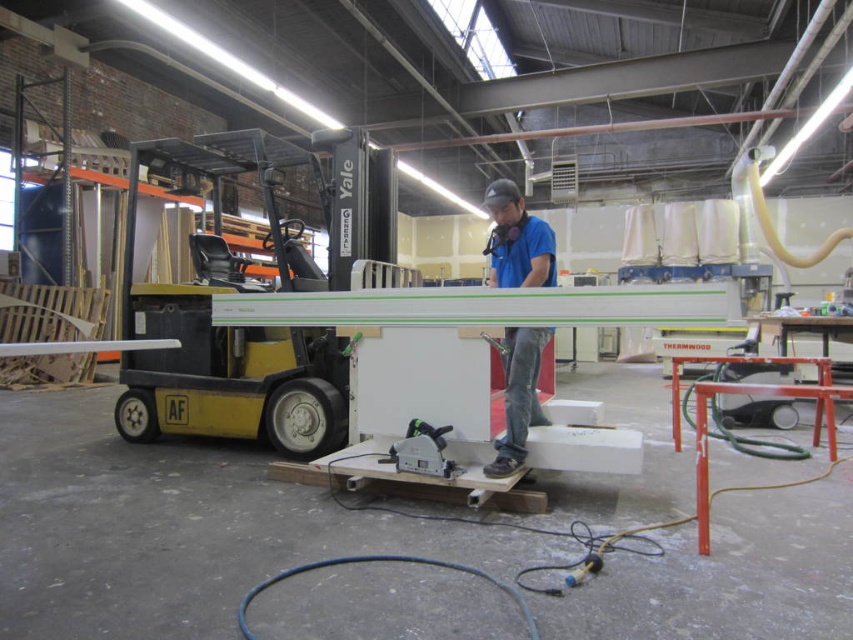
Question: Estimate the real-world distances between objects in this image. Which object is closer to the yellow/black plastic forklift at left?

Choices:
 (A) green plastic circular saw at center
 (B) blue cotton shirt at center

Answer: (A)

Question: Is yellow/black plastic forklift at left to the right of blue cotton shirt at center from the viewer's perspective?

Choices:
 (A) no
 (B) yes

Answer: (A)

Question: Does blue cotton shirt at center appear on the right side of green plastic circular saw at center?

Choices:
 (A) no
 (B) yes

Answer: (B)

Question: Is yellow/black plastic forklift at left below blue cotton shirt at center?

Choices:
 (A) no
 (B) yes

Answer: (A)

Question: Which point is farther to the camera?

Choices:
 (A) blue cotton shirt at center
 (B) yellow/black plastic forklift at left

Answer: (B)

Question: Which object appears farthest from the camera in this image?

Choices:
 (A) yellow/black plastic forklift at left
 (B) green plastic circular saw at center
 (C) blue cotton shirt at center

Answer: (A)